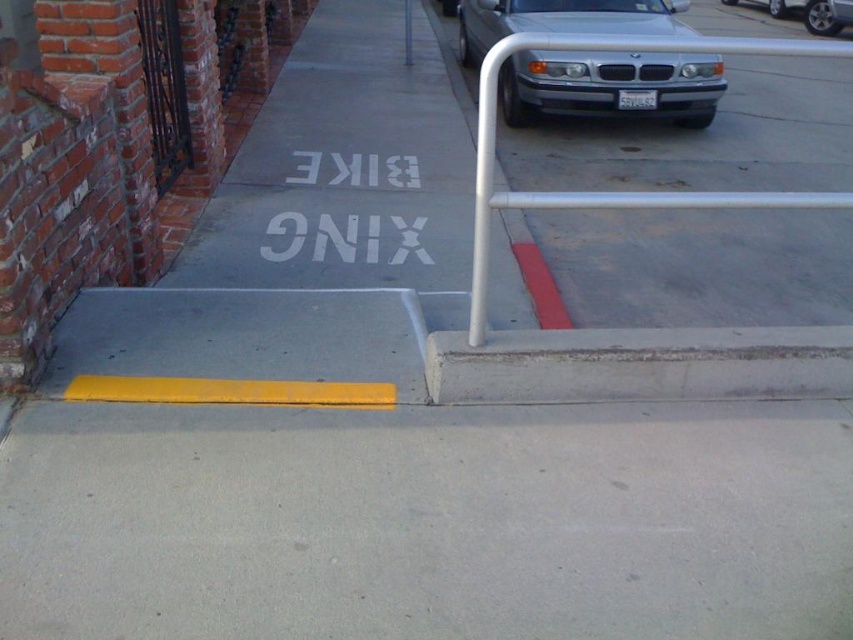
You are a delivery person with a 1.2 meter wide cart. You need to navigate through the sidewalk area shown in the image. Can your cart fit between the concrete at lower center and the silver metallic car at upper center?

The concrete at lower center is thinner than the silver metallic car at upper center. Since the concrete is thinner, the space between them is wider than the concrete itself. However, without exact measurements, it is uncertain if the space is at least 1.2 meters wide. The answer cannot be definitively determined with the given information.

You are a delivery person needing to park your bike at the bike xing area. The silver metallic car at upper right is blocking the yellow painted pole at upper center. Can you safely move your bike around the car to access the pole?

The silver metallic car at upper right is positioned over the yellow painted pole at upper center, so you cannot safely move your bike around the car to access the pole.